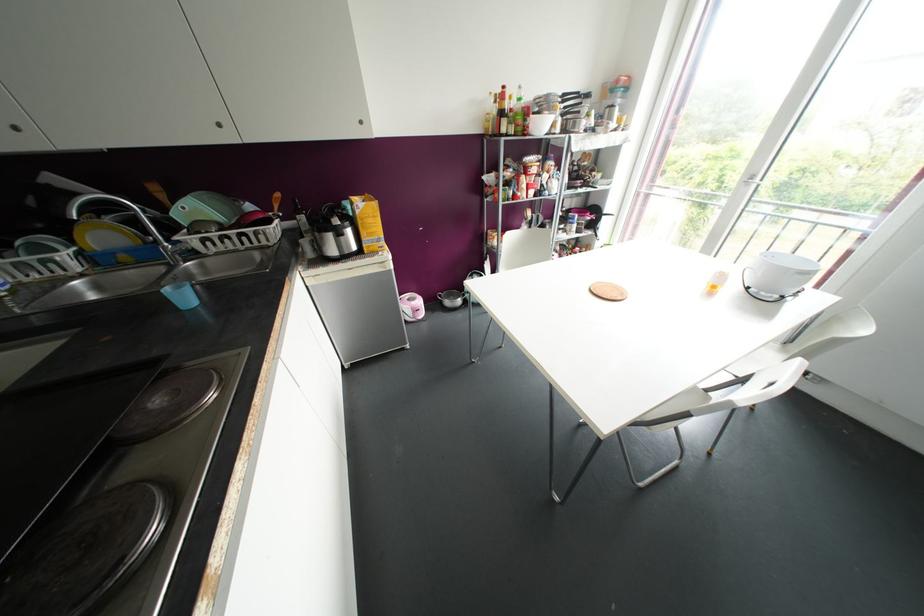
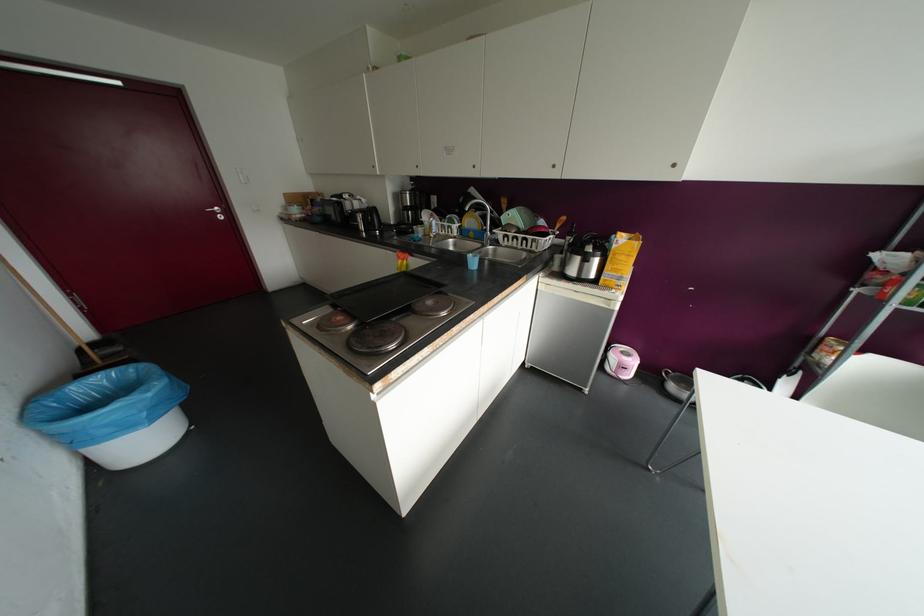
In the second image, find the point that corresponds to (152,361) in the first image.

(441, 284)